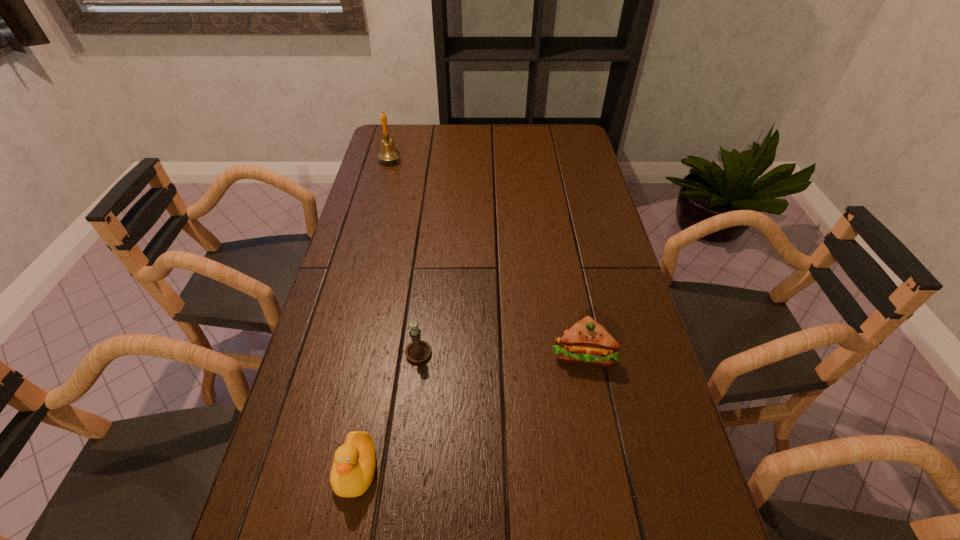
Where is `the tallest object`? the tallest object is located at coordinates (388, 152).

Locate an element on the screen. the leftmost object is located at coordinates (388, 152).

Find the location of a particular element. This screenshot has width=960, height=540. the rightmost object is located at coordinates (587, 341).

Locate an element on the screen. Image resolution: width=960 pixels, height=540 pixels. candle holder is located at coordinates (418, 350).

Identify the location of the nearest object. (353, 469).

You are a GUI agent. You are given a task and a screenshot of the screen. Output one action in this format:
    pyautogui.click(x=<x>, y=<y>)
    Task: Click on the third object from right to left
    
    Given the screenshot: What is the action you would take?
    pyautogui.click(x=353, y=469)

Identify the location of vacant area situated on the right of the tallest object. Image resolution: width=960 pixels, height=540 pixels. (455, 160).

This screenshot has width=960, height=540. I want to click on vacant space located 0.300m on the left of the sandwich, so click(424, 353).

Identify the location of vacant area situated 0.160m on the side of the candle holder with the handle. This screenshot has width=960, height=540. (426, 288).

The width and height of the screenshot is (960, 540). Identify the location of free space located on the side of the candle holder with the handle. (430, 248).